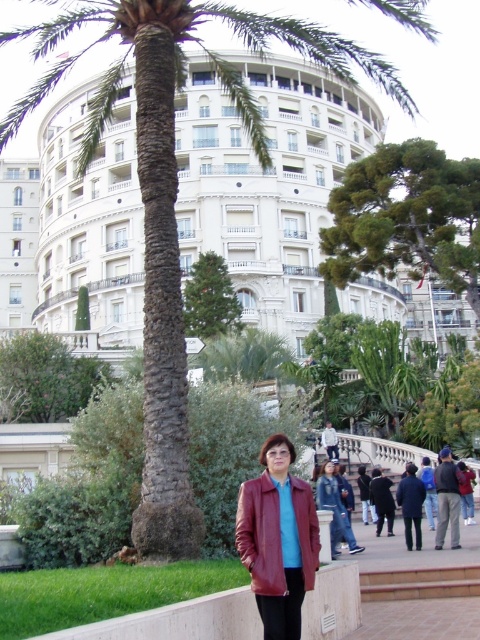
You are a photographer trying to capture the white glossy building at upper left in your shot while also including the leather jacket at center. Based on their positions, which direction should you move your camera to include both in the frame?

The leather jacket at center is to the right of the white glossy building at upper left. To include both in the frame, you should move your camera to the right to capture the leather jacket at center and then adjust to include the white glossy building at upper left.

You are a photographer trying to capture a photo of the white glossy building at upper left. You notice the leather jacket at center is blocking part of the building. Can you determine if the building is taller than the jacket?

The leather jacket at center is shorter than the white glossy building at upper left, so the building is taller and the jacket is shorter, meaning the building is taller than the jacket. Therefore, the building is indeed taller than the jacket, so the jacket might be blocking part of the building but the building itself is taller.